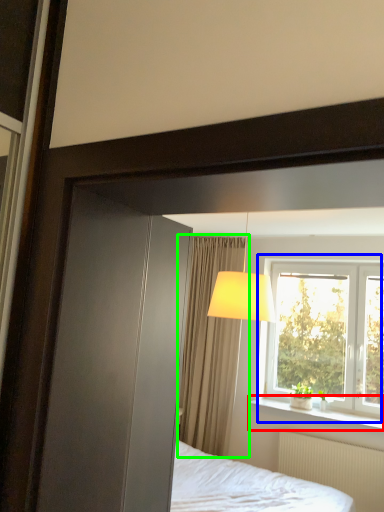
Question: Estimate the real-world distances between objects in this image. Which object is closer to window sill (highlighted by a red box), window (highlighted by a blue box) or curtain (highlighted by a green box)?

Choices:
 (A) window
 (B) curtain

Answer: (A)